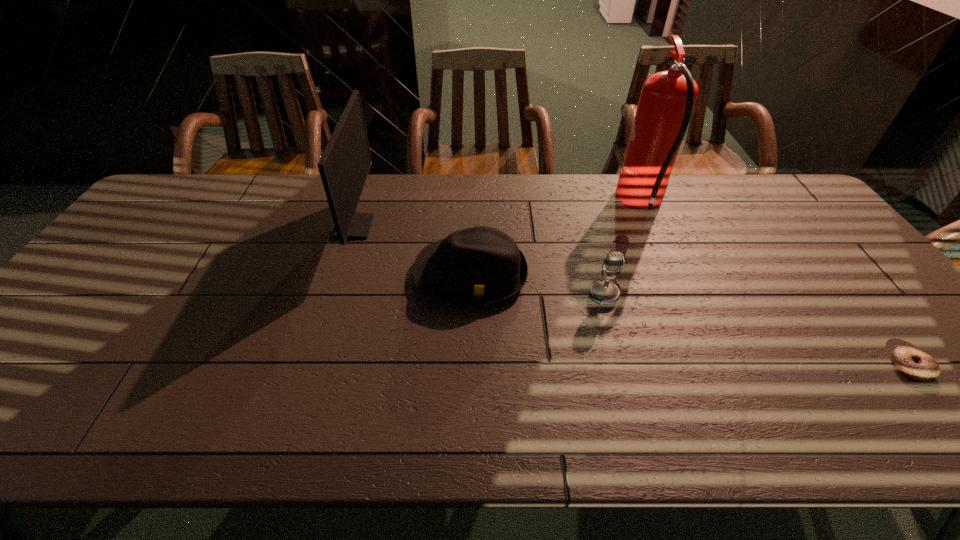
This screenshot has width=960, height=540. I want to click on vacant region that satisfies the following two spatial constraints: 1. towards the nozzle of the nearest object; 2. on the left side of the fire extinguisher, so click(x=714, y=367).

This screenshot has height=540, width=960. Find the location of `free location that satisfies the following two spatial constraints: 1. towards the nozzle of the fire extinguisher; 2. on the front-facing side of the fourth tallest object`. free location that satisfies the following two spatial constraints: 1. towards the nozzle of the fire extinguisher; 2. on the front-facing side of the fourth tallest object is located at coordinates click(x=674, y=275).

I want to click on vacant space that satisfies the following two spatial constraints: 1. towards the nozzle of the fire extinguisher; 2. on the front-facing side of the fourth object from right to left, so click(674, 275).

I want to click on free space in the image that satisfies the following two spatial constraints: 1. on the front-facing side of the second object from left to right; 2. on the left side of the rightmost object, so click(468, 367).

Where is `vacant space that satisfies the following two spatial constraints: 1. on the front-facing side of the fourth tallest object; 2. on the left side of the doughnut`? vacant space that satisfies the following two spatial constraints: 1. on the front-facing side of the fourth tallest object; 2. on the left side of the doughnut is located at coordinates (468, 367).